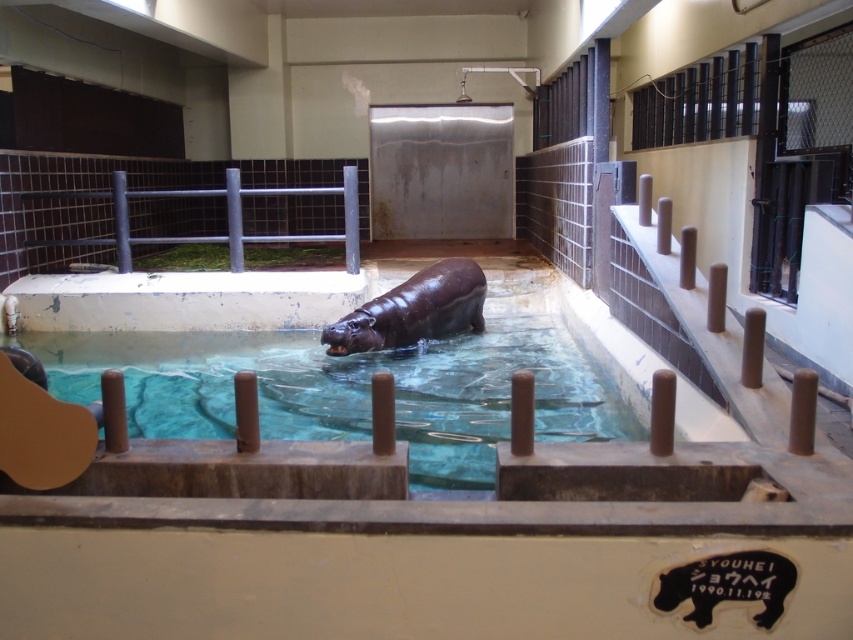
Question: Does translucent glass pool at center have a smaller size compared to metallic gray rail at upper left?

Choices:
 (A) no
 (B) yes

Answer: (A)

Question: Does translucent glass pool at center lie in front of shiny brown hippo at center?

Choices:
 (A) no
 (B) yes

Answer: (B)

Question: Which is nearer to the translucent glass pool at center?

Choices:
 (A) metallic gray rail at upper left
 (B) shiny brown hippo at center

Answer: (B)

Question: Which of the following is the closest to the observer?

Choices:
 (A) translucent glass pool at center
 (B) shiny brown hippo at center
 (C) metallic gray rail at upper left

Answer: (A)

Question: Among these objects, which one is nearest to the camera?

Choices:
 (A) shiny brown hippo at center
 (B) translucent glass pool at center
 (C) metallic gray rail at upper left

Answer: (B)

Question: Is translucent glass pool at center thinner than shiny brown hippo at center?

Choices:
 (A) yes
 (B) no

Answer: (B)